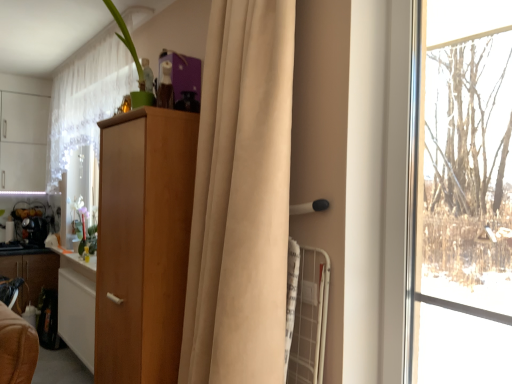
Question: Can light brown wood cabinet at center, the first cabinetry in the front-to-back sequence, be found inside wooden cabinet at left, arranged as the 1th cabinetry when viewed from the back?

Choices:
 (A) yes
 (B) no

Answer: (B)

Question: Is wooden cabinet at left, marked as the second cabinetry in a right-to-left arrangement, wider than light brown wood cabinet at center, the first cabinetry in the front-to-back sequence?

Choices:
 (A) yes
 (B) no

Answer: (B)

Question: Is wooden cabinet at left, marked as the second cabinetry in a right-to-left arrangement, to the right of light brown wood cabinet at center, the 2th cabinetry viewed from the back, from the viewer's perspective?

Choices:
 (A) yes
 (B) no

Answer: (B)

Question: From a real-world perspective, is wooden cabinet at left, marked as the second cabinetry in a right-to-left arrangement, over light brown wood cabinet at center, the 2th cabinetry viewed from the back?

Choices:
 (A) no
 (B) yes

Answer: (A)

Question: Is wooden cabinet at left, arranged as the 1th cabinetry when viewed from the back, closer to camera compared to light brown wood cabinet at center, the first cabinetry from the right?

Choices:
 (A) no
 (B) yes

Answer: (A)

Question: Considering the positions of beige fabric curtain at center, positioned as the 2th curtain in back-to-front order, and white sheer curtain at upper left, acting as the 1th curtain starting from the left, in the image, is beige fabric curtain at center, positioned as the 2th curtain in back-to-front order, bigger or smaller than white sheer curtain at upper left, acting as the 1th curtain starting from the left,?

Choices:
 (A) small
 (B) big

Answer: (A)

Question: Looking at their shapes, would you say beige fabric curtain at center, positioned as the 1th curtain in front-to-back order, is wider or thinner than white sheer curtain at upper left, placed as the second curtain when sorted from right to left?

Choices:
 (A) wide
 (B) thin

Answer: (A)

Question: From the image's perspective, is beige fabric curtain at center, the second curtain viewed from the left, located above or below white sheer curtain at upper left, acting as the 1th curtain starting from the left?

Choices:
 (A) below
 (B) above

Answer: (A)

Question: Visually, is beige fabric curtain at center, the second curtain viewed from the left, positioned to the left or to the right of white sheer curtain at upper left, the second curtain viewed from the front?

Choices:
 (A) left
 (B) right

Answer: (B)

Question: In terms of width, does wooden cabinet at left, placed as the first cabinetry when sorted from left to right, look wider or thinner when compared to white sheer curtain at upper left, the second curtain viewed from the front?

Choices:
 (A) wide
 (B) thin

Answer: (B)

Question: Would you say wooden cabinet at left, placed as the first cabinetry when sorted from left to right, is to the left or to the right of white sheer curtain at upper left, positioned as the 1th curtain in back-to-front order, in the picture?

Choices:
 (A) right
 (B) left

Answer: (B)

Question: Do you think wooden cabinet at left, the 2th cabinetry positioned from the front, is within white sheer curtain at upper left, positioned as the 1th curtain in back-to-front order, or outside of it?

Choices:
 (A) outside
 (B) inside

Answer: (A)

Question: From a real-world perspective, relative to white sheer curtain at upper left, the second curtain viewed from the front, is wooden cabinet at left, arranged as the 1th cabinetry when viewed from the back, vertically above or below?

Choices:
 (A) below
 (B) above

Answer: (A)

Question: Is metallic silver kettle at left, marked as the 1th appliance in a back-to-front arrangement, to the left or to the right of wooden cabinet at left, the 2th cabinetry positioned from the front, in the image?

Choices:
 (A) left
 (B) right

Answer: (A)

Question: From the image's perspective, is metallic silver kettle at left, which is the 2th appliance from front to back, positioned above or below wooden cabinet at left, placed as the first cabinetry when sorted from left to right?

Choices:
 (A) above
 (B) below

Answer: (A)